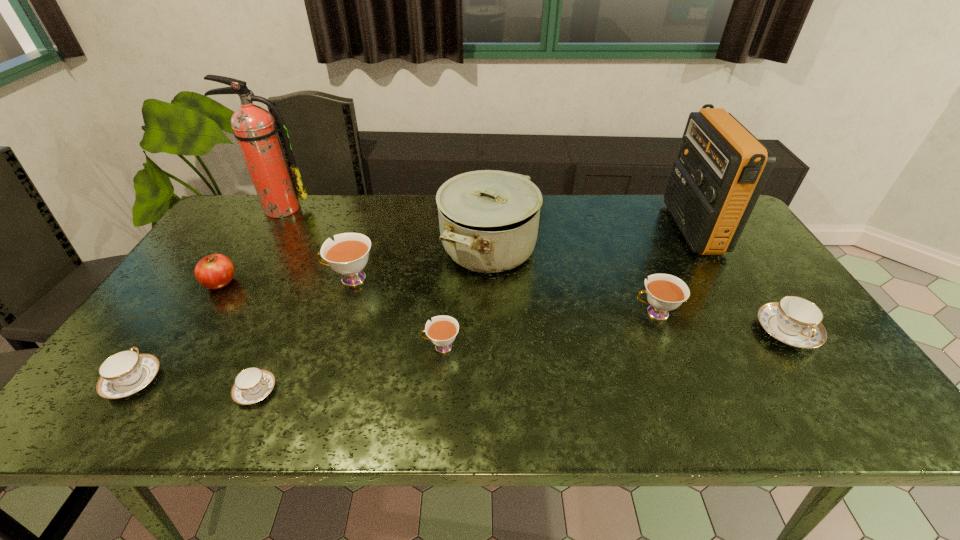
At what (x,y) coordinates should I click in order to perform the action: click on vacant space at the near right corner of the desktop. Please return your answer as a coordinate pair (x, y). Looking at the image, I should click on (829, 392).

This screenshot has height=540, width=960. In order to click on free space between the red apple and the second biggest blue teacup in this screenshot , I will do `click(178, 332)`.

The image size is (960, 540). In order to click on empty location between the red apple and the fire extinguisher in this screenshot , I will do `click(251, 246)`.

Where is `vacant region between the second teacup from left to right and the farthest blue teacup`? This screenshot has width=960, height=540. vacant region between the second teacup from left to right and the farthest blue teacup is located at coordinates (521, 361).

Identify the location of vacant space that's between the apple and the second blue teacup from right to left. click(x=238, y=337).

Where is `empty space between the farthest white teacup and the smallest blue teacup`? The width and height of the screenshot is (960, 540). empty space between the farthest white teacup and the smallest blue teacup is located at coordinates (303, 335).

Find the location of a particular element. The width and height of the screenshot is (960, 540). blank region between the leftmost blue teacup and the radio receiver is located at coordinates (413, 305).

Where is `empty space that is in between the radio receiver and the rightmost teacup`? empty space that is in between the radio receiver and the rightmost teacup is located at coordinates (739, 280).

At what (x,y) coordinates should I click in order to perform the action: click on unoccupied position between the eighth shortest object and the leftmost teacup. Please return your answer as a coordinate pair (x, y). The width and height of the screenshot is (960, 540). Looking at the image, I should click on (311, 314).

Identify which object is the third nearest to the leftmost blue teacup. Please provide its 2D coordinates. Your answer should be formatted as a tuple, i.e. [(x, y)], where the tuple contains the x and y coordinates of a point satisfying the conditions above.

[(348, 255)]